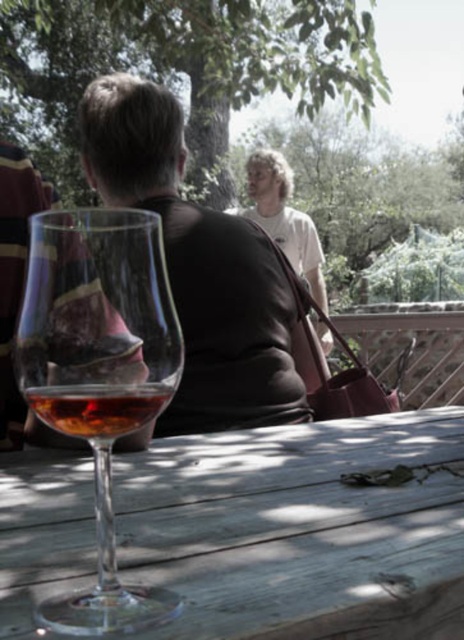
You are standing at the edge of the patio and want to place a decorative vase on the wooden table at center. Given that the coordinates of the table are marked at point (287, 518), can you determine if the vase will fit on the table?

The coordinates of the wooden table at center are marked at point (287, 518), but there is no information provided about the table size or the vase dimensions. Therefore, it is impossible to determine if the vase will fit on the table.

You are setting up a picnic and have both a transparent glass wine glass at lower left and an amber glass at center. You want to pour a full glass of wine without spilling. Which glass should you choose?

The transparent glass wine glass at lower left might be wider than the amber glass at center, so it can hold more wine without spilling.

You are a server at a garden party and need to place a dessert plate between the transparent glass wine glass at lower left and the amber glass at center. The plate is 2 inches wide. Can you fit it between them without moving the glasses?

The transparent glass wine glass at lower left is 1.30 inches away from the amber glass at center. Since the plate is 2 inches wide, which is wider than the space between them, the plate cannot be placed between the glasses without moving them.